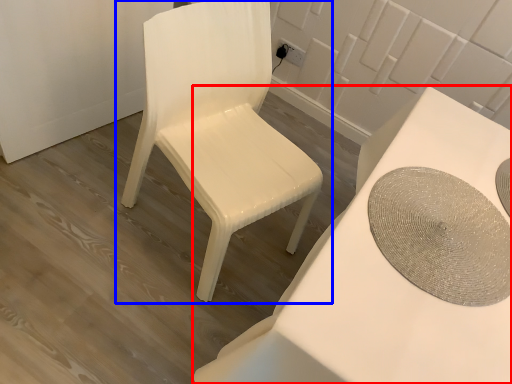
Question: Which object appears farthest to the camera in this image, table (highlighted by a red box) or chair (highlighted by a blue box)?

Choices:
 (A) table
 (B) chair

Answer: (B)